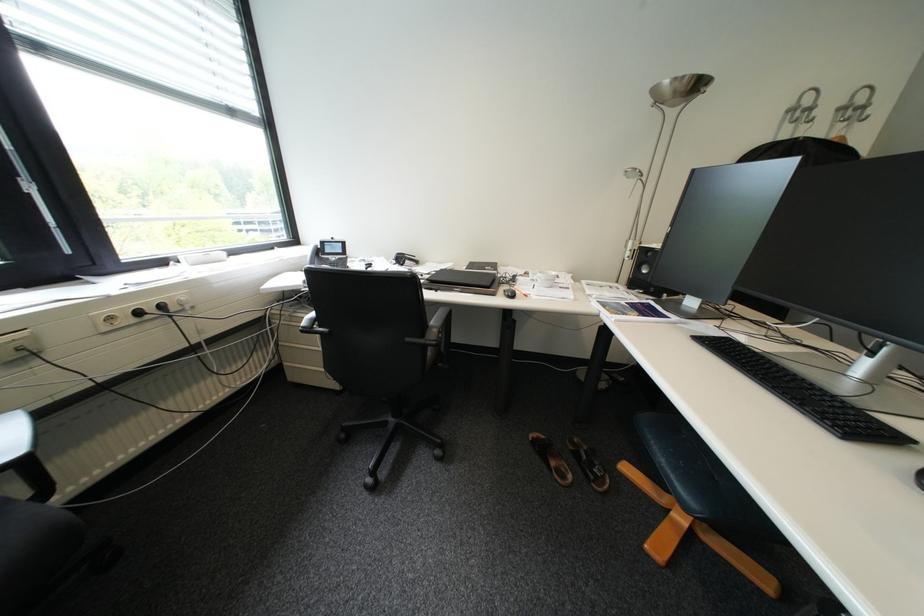
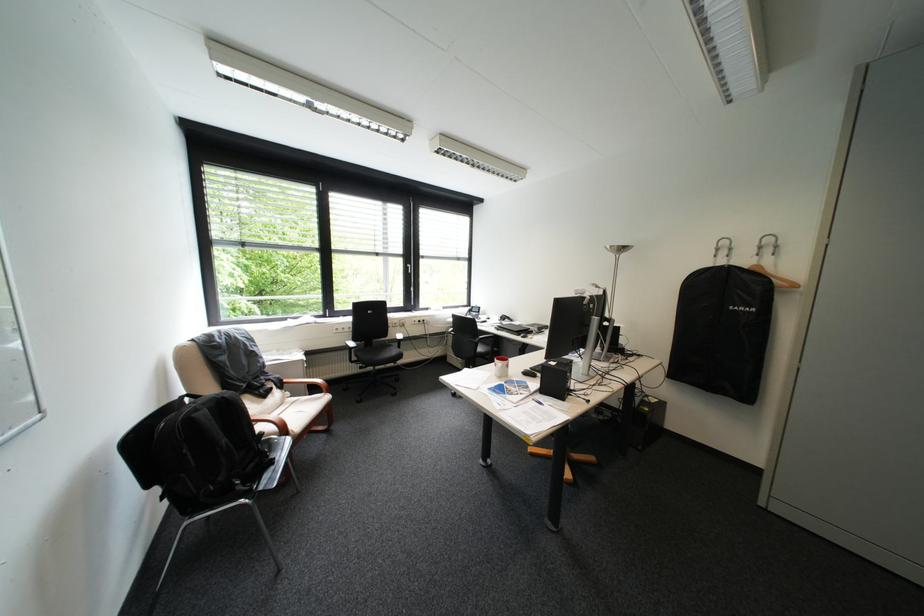
In the second image, find the point that corresponds to (x=282, y=248) in the first image.

(469, 307)